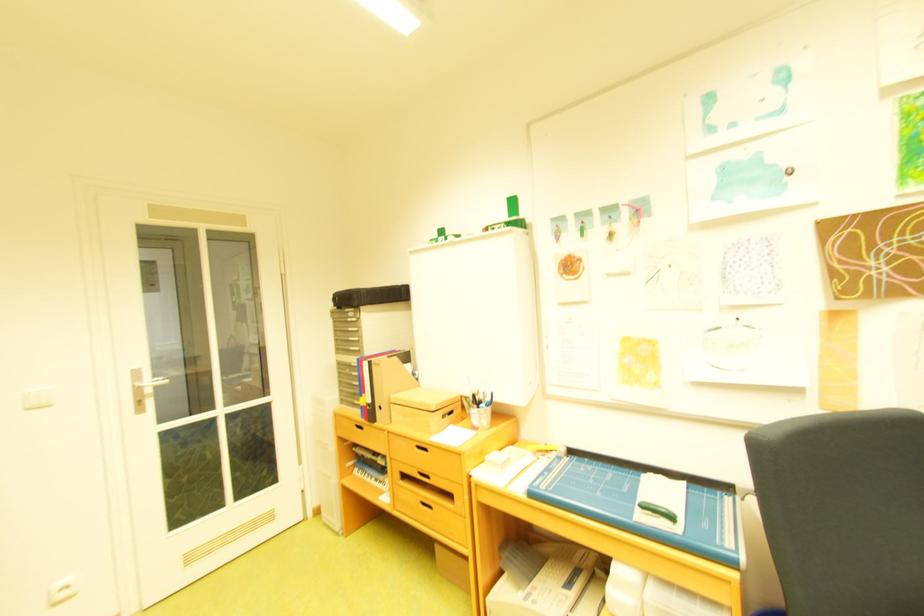
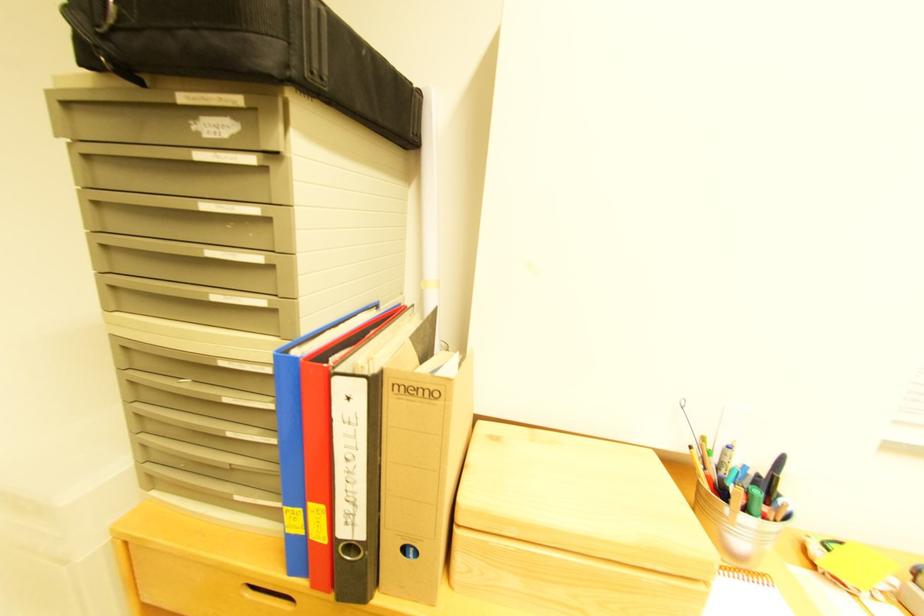
Where in the second image is the point corresponding to the point at 381,402 from the first image?

(371, 536)